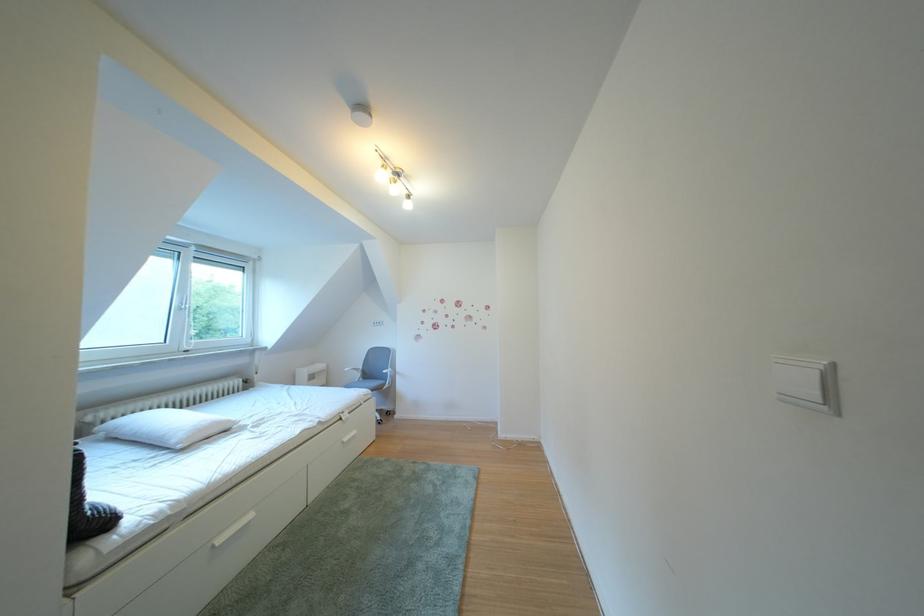
This screenshot has width=924, height=616. What do you see at coordinates (185, 286) in the screenshot?
I see `the white window handle` at bounding box center [185, 286].